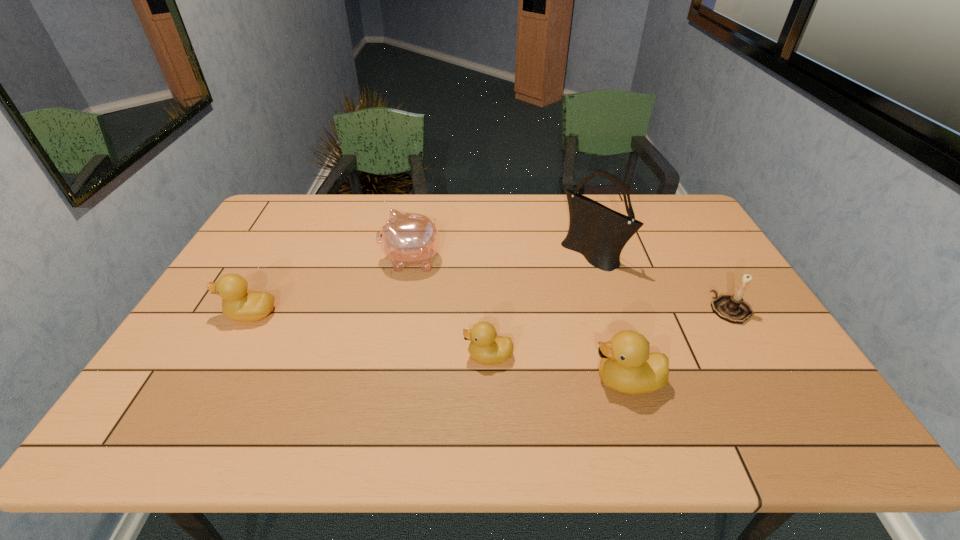
The image size is (960, 540). What are the coordinates of `vacant space located on the face of the shortest duckling` in the screenshot? It's located at (428, 356).

At what (x,y) coordinates should I click in order to perform the action: click on vacant area situated on the face of the shortest duckling. Please return your answer as a coordinate pair (x, y). Image resolution: width=960 pixels, height=540 pixels. Looking at the image, I should click on (416, 356).

Identify the location of free spot located 0.390m on the face of the rightmost duckling. The width and height of the screenshot is (960, 540). (427, 381).

Where is `free space located 0.180m on the face of the rightmost duckling`? The width and height of the screenshot is (960, 540). free space located 0.180m on the face of the rightmost duckling is located at coordinates (516, 381).

Locate an element on the screen. The image size is (960, 540). free region located on the face of the rightmost duckling is located at coordinates (482, 381).

Locate an element on the screen. The width and height of the screenshot is (960, 540). vacant space located 0.320m on the back of the rightmost object is located at coordinates (684, 232).

The height and width of the screenshot is (540, 960). Identify the location of free region located on the front facing side of the fifth object from right to left. (299, 260).

You are a GUI agent. You are given a task and a screenshot of the screen. Output one action in this format:
    pyautogui.click(x=<x>, y=<y>)
    Task: Click on the vacant space located on the front facing side of the fifth object from right to left
    This screenshot has height=540, width=960.
    Given the screenshot: What is the action you would take?
    pyautogui.click(x=308, y=260)

Find the location of a particular element. Image resolution: width=960 pixels, height=540 pixels. free space located on the front facing side of the fifth object from right to left is located at coordinates (318, 260).

The height and width of the screenshot is (540, 960). I want to click on free region located 0.090m on the back of the tallest object, so click(x=583, y=221).